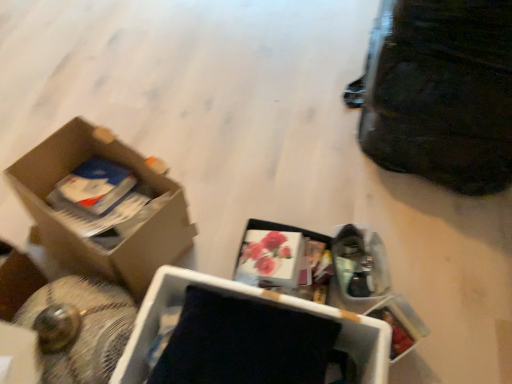
At what (x,y) coordinates should I click in order to perform the action: click on free space that is in between black leather bag at upper right and cardboard box at left, placed as the first box when sorted from left to right. Please return your answer as a coordinate pair (x, y). This screenshot has width=512, height=384. Looking at the image, I should click on 300,157.